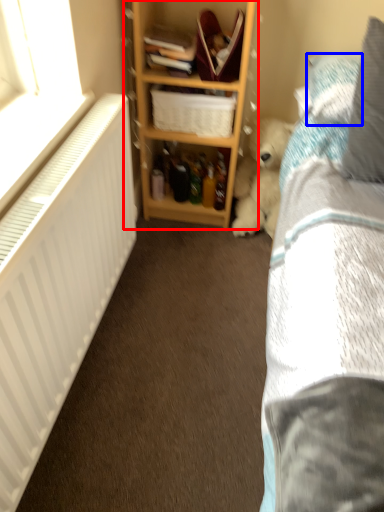
Question: Which of the following is the farthest to the observer, shelf (highlighted by a red box) or pillow (highlighted by a blue box)?

Choices:
 (A) shelf
 (B) pillow

Answer: (A)